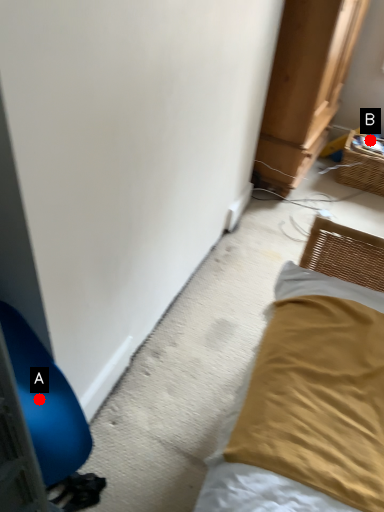
Question: Two points are circled on the image, labeled by A and B beside each circle. Among these points, which one is farthest from the camera?

Choices:
 (A) A is further
 (B) B is further

Answer: (B)